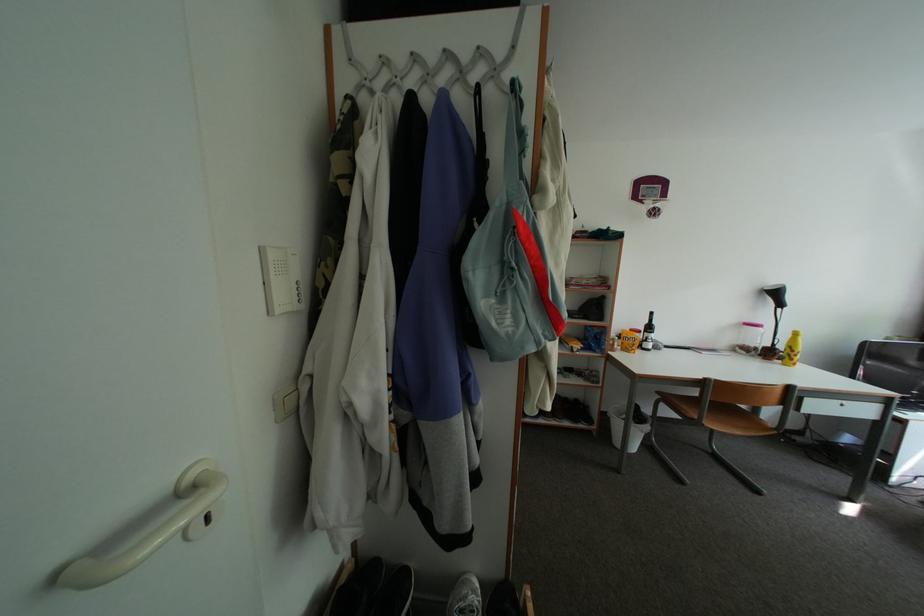
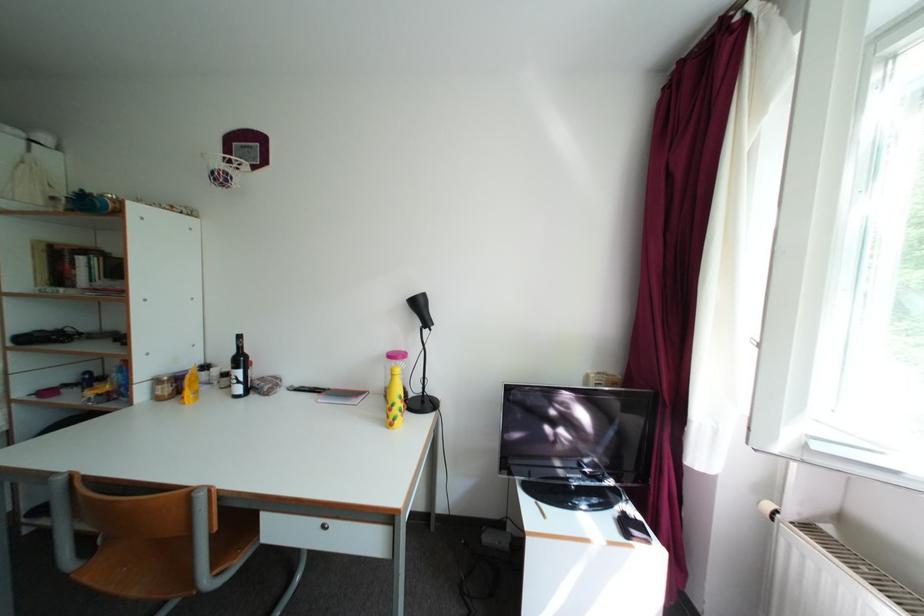
Question: The images are taken continuously from a first-person perspective. In which direction are you moving?

Choices:
 (A) Left
 (B) Right
 (C) Forward
 (D) Backward

Answer: (B)